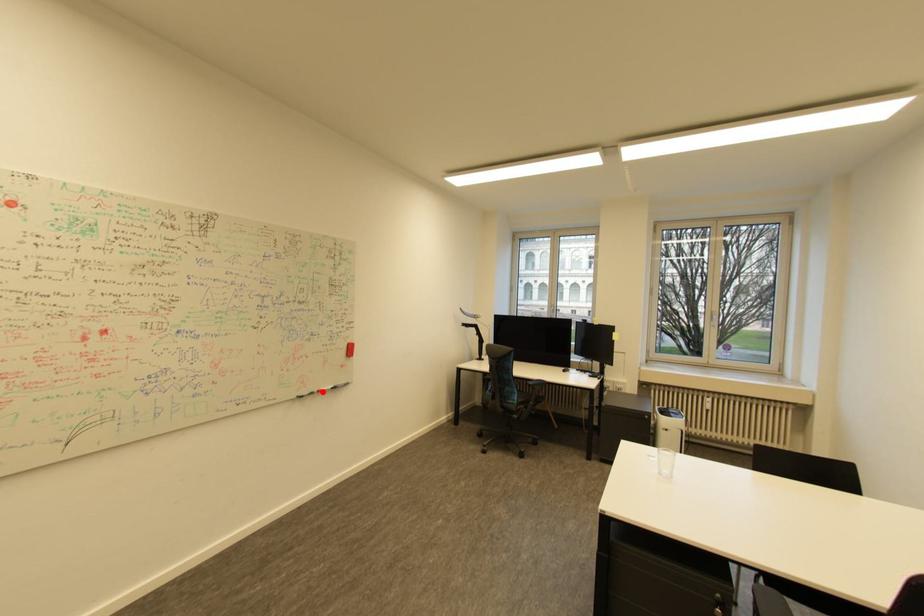
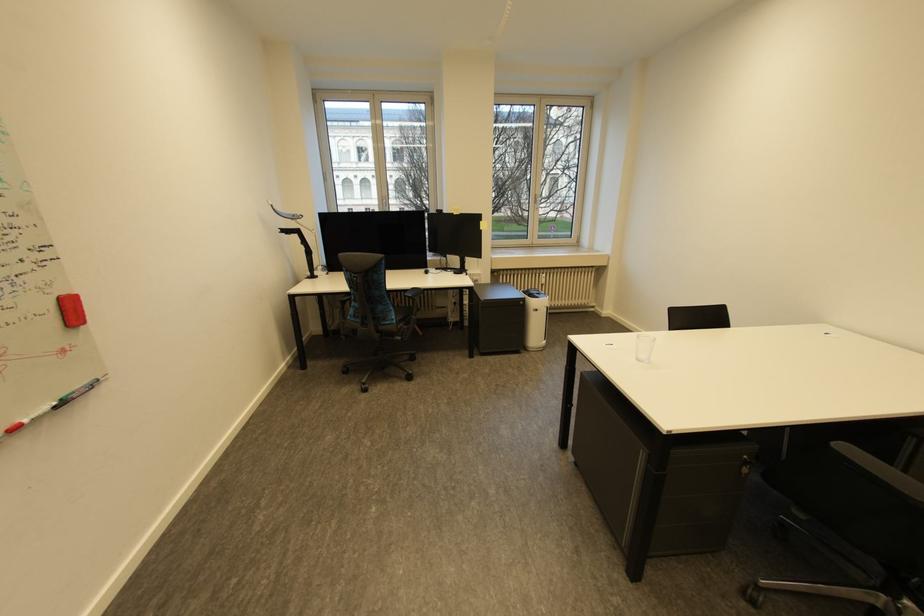
Question: A red point is marked in image1. In image2, is the corresponding 3D point closer to the camera or farther? Reply with the corresponding letter.

Choices:
 (A) The corresponding 3D point is closer.
 (B) The corresponding 3D point is farther.

Answer: (B)